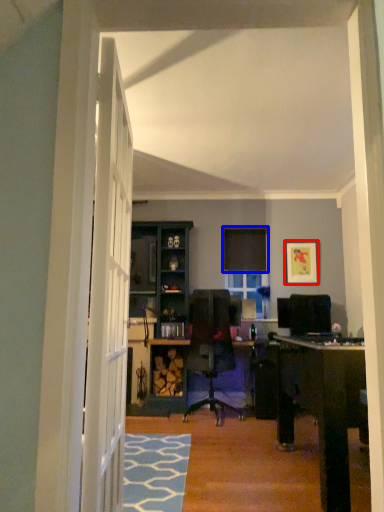
Question: Which of the following is the farthest to the observer, picture frame (highlighted by a red box) or curtain (highlighted by a blue box)?

Choices:
 (A) picture frame
 (B) curtain

Answer: (B)